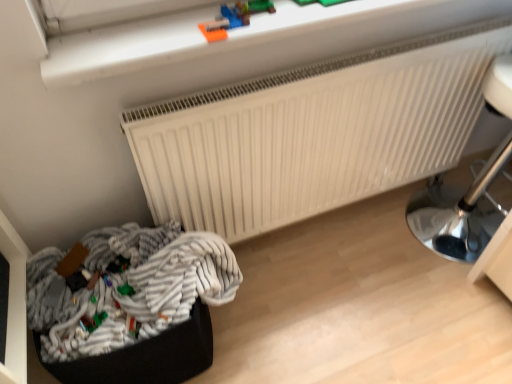
Locate an element on the screen. The image size is (512, 384). vacant region in front of metallic silver lamp at right is located at coordinates (456, 310).